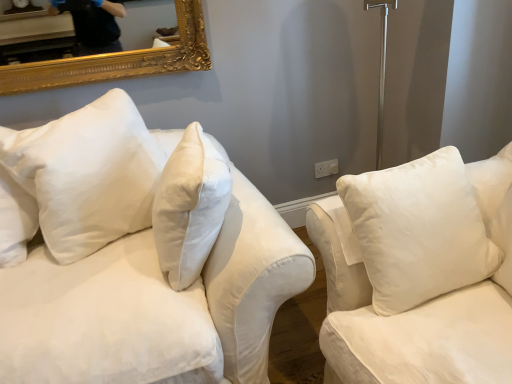
Question: Is white cotton couch at left to the right of white plastic electric outlet at center-right from the viewer's perspective?

Choices:
 (A) yes
 (B) no

Answer: (B)

Question: From a real-world perspective, is white cotton couch at left beneath white plastic electric outlet at center-right?

Choices:
 (A) no
 (B) yes

Answer: (A)

Question: Can you confirm if white cotton couch at left is thinner than white plastic electric outlet at center-right?

Choices:
 (A) no
 (B) yes

Answer: (A)

Question: From the image's perspective, does white cotton couch at left appear lower than white plastic electric outlet at center-right?

Choices:
 (A) yes
 (B) no

Answer: (A)

Question: Considering the relative sizes of white cotton couch at left and white plastic electric outlet at center-right in the image provided, is white cotton couch at left taller than white plastic electric outlet at center-right?

Choices:
 (A) no
 (B) yes

Answer: (B)

Question: In terms of height, does white plastic electric outlet at center-right look taller or shorter compared to white cotton pillow at upper left, the second pillow positioned from the right?

Choices:
 (A) short
 (B) tall

Answer: (A)

Question: From a real-world perspective, is white plastic electric outlet at center-right above or below white cotton pillow at upper left, the 1th pillow positioned from the left?

Choices:
 (A) below
 (B) above

Answer: (A)

Question: Considering their positions, is white plastic electric outlet at center-right located in front of or behind white cotton pillow at upper left, the 1th pillow positioned from the left?

Choices:
 (A) front
 (B) behind

Answer: (B)

Question: Based on their positions, is white plastic electric outlet at center-right located to the left or right of white cotton pillow at upper left, the second pillow positioned from the right?

Choices:
 (A) left
 (B) right

Answer: (B)

Question: From the image's perspective, is white cotton pillow at upper left, the 1th pillow positioned from the left, located above or below white plastic electric outlet at center-right?

Choices:
 (A) above
 (B) below

Answer: (B)

Question: Is white cotton pillow at upper left, the 1th pillow positioned from the left, spatially inside white plastic electric outlet at center-right, or outside of it?

Choices:
 (A) inside
 (B) outside

Answer: (B)

Question: From a real-world perspective, is white cotton pillow at upper left, the 1th pillow positioned from the left, physically located above or below white plastic electric outlet at center-right?

Choices:
 (A) above
 (B) below

Answer: (A)

Question: From their relative heights in the image, would you say white cotton pillow at upper left, the second pillow positioned from the right, is taller or shorter than white plastic electric outlet at center-right?

Choices:
 (A) tall
 (B) short

Answer: (A)

Question: Considering the positions of white cotton couch at left and white plastic electric outlet at center-right in the image, is white cotton couch at left taller or shorter than white plastic electric outlet at center-right?

Choices:
 (A) tall
 (B) short

Answer: (A)

Question: Is point (234, 225) closer or farther from the camera than point (323, 170)?

Choices:
 (A) farther
 (B) closer

Answer: (B)